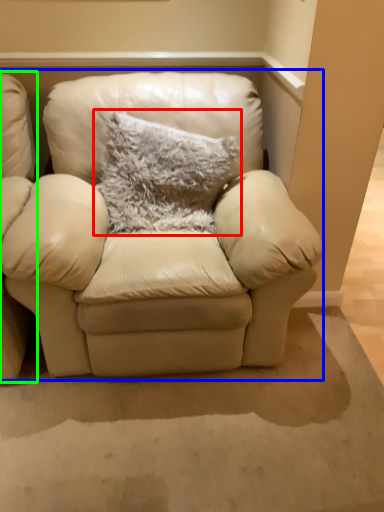
Question: Considering the real-world distances, which object is closest to pillow (highlighted by a red box)? studio couch (highlighted by a blue box) or chair (highlighted by a green box).

Choices:
 (A) studio couch
 (B) chair

Answer: (A)